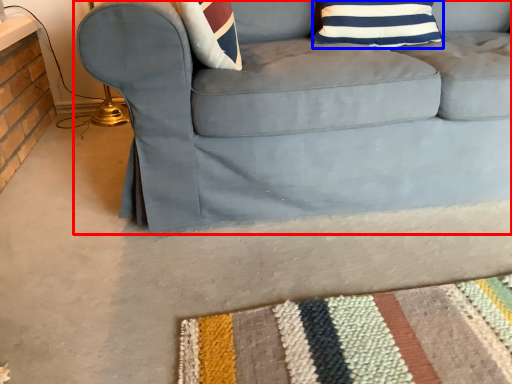
Question: Which of the following is the closest to the observer, studio couch (highlighted by a red box) or pillow (highlighted by a blue box)?

Choices:
 (A) studio couch
 (B) pillow

Answer: (A)